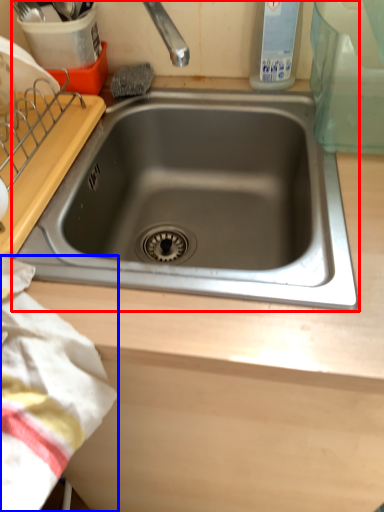
Question: Which object is further to the camera taking this photo, sink (highlighted by a red box) or blanket (highlighted by a blue box)?

Choices:
 (A) sink
 (B) blanket

Answer: (A)